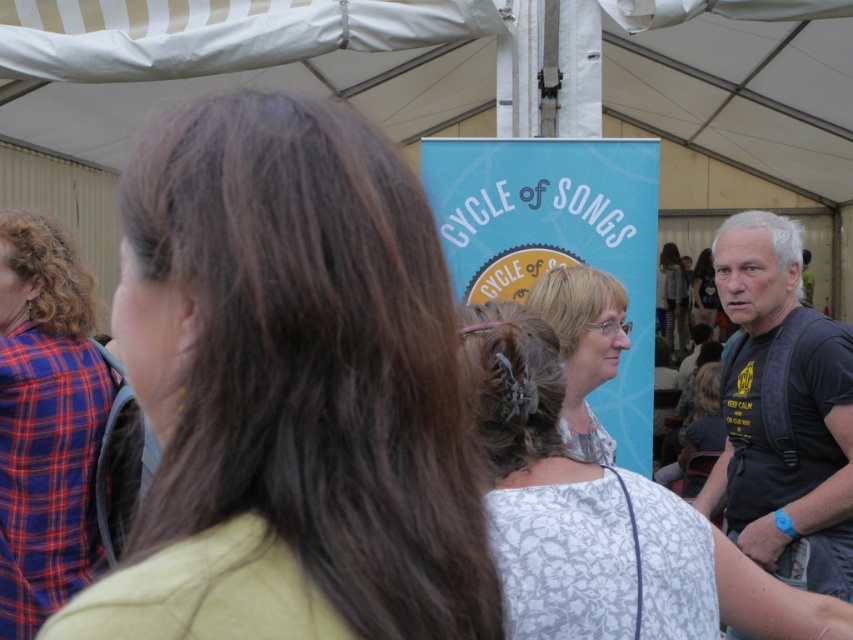
Question: Based on their relative distances, which object is farther from the white textured blouse at center?

Choices:
 (A) black t-shirt at right
 (B) white lace dress at center
 (C) white floral dress at center
 (D) light brown hair at center

Answer: (D)

Question: Is white floral dress at center positioned before white lace dress at center?

Choices:
 (A) yes
 (B) no

Answer: (A)

Question: Which point appears farthest from the camera in this image?

Choices:
 (A) (631, 497)
 (B) (64, 321)
 (C) (729, 260)
 (D) (288, 458)

Answer: (C)

Question: Is plaid fabric shirt at left positioned behind white lace blouse at center?

Choices:
 (A) yes
 (B) no

Answer: (A)

Question: Which is farther from the light brown hair at center?

Choices:
 (A) white textured blouse at center
 (B) plaid fabric shirt at left
 (C) white lace blouse at center

Answer: (A)

Question: Does black t-shirt at right appear under white lace dress at center?

Choices:
 (A) no
 (B) yes

Answer: (B)